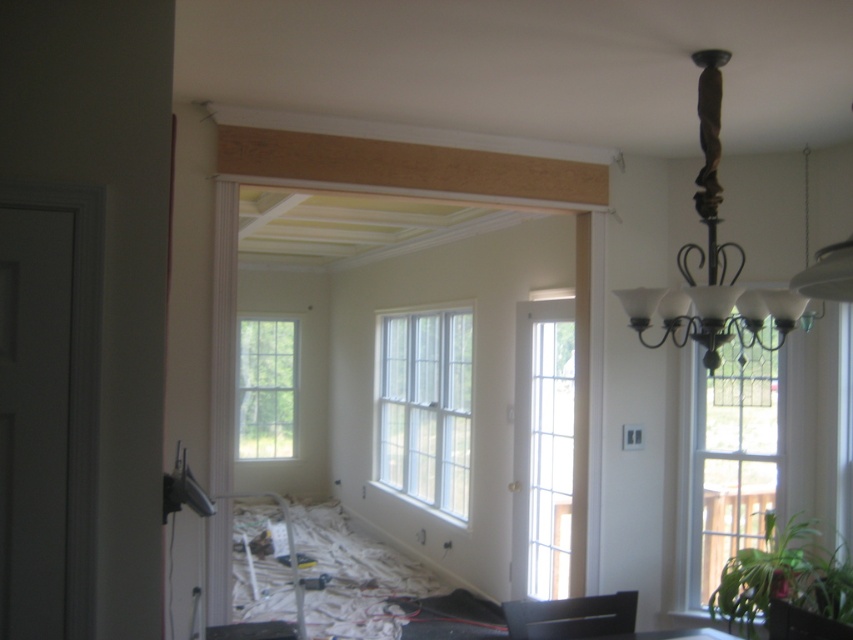
Question: Is white glass window at center thinner than black matte chair at lower center?

Choices:
 (A) yes
 (B) no

Answer: (B)

Question: Which point is closer to the camera taking this photo?

Choices:
 (A) (286, 353)
 (B) (514, 632)
 (C) (750, 538)
 (D) (700, 76)

Answer: (D)

Question: Estimate the real-world distances between objects in this image. Which object is farther from the matte black chandelier at upper center?

Choices:
 (A) white glass window at center
 (B) clear glass window at right
 (C) black plastic chair at lower right
 (D) clear glass window at center

Answer: (D)

Question: Among these objects, which one is nearest to the camera?

Choices:
 (A) black plastic chair at lower right
 (B) white glass window at center

Answer: (A)

Question: Observing the image, what is the correct spatial positioning of clear glass window at right in reference to matte black chandelier at upper center?

Choices:
 (A) left
 (B) right

Answer: (B)

Question: Does white glass window at center have a smaller size compared to black matte chair at lower center?

Choices:
 (A) no
 (B) yes

Answer: (A)